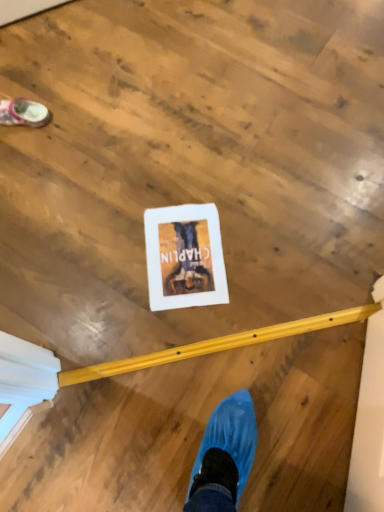
Identify the location of vacant space situated above white paper at center (from a real-world perspective). The image size is (384, 512). (185, 254).